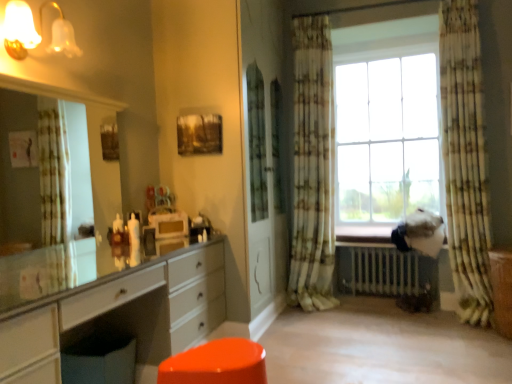
This screenshot has width=512, height=384. What are the coordinates of `free space that is to the left of floral fabric curtain at right, the 2th curtain from the left` in the screenshot? It's located at (432, 329).